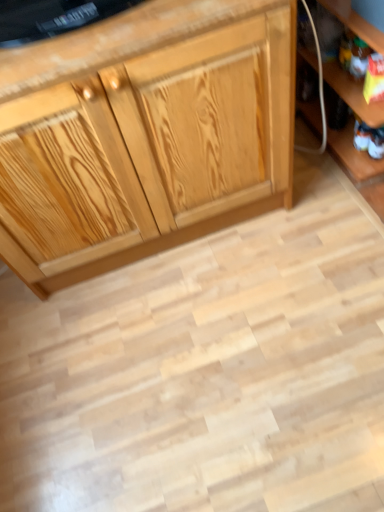
Question: Can we say wooden shelf at lower right lies outside white fabric toy at lower right?

Choices:
 (A) yes
 (B) no

Answer: (A)

Question: Is wooden shelf at lower right thinner than white fabric toy at lower right?

Choices:
 (A) yes
 (B) no

Answer: (B)

Question: Can you confirm if wooden shelf at lower right is shorter than white fabric toy at lower right?

Choices:
 (A) no
 (B) yes

Answer: (A)

Question: Considering the relative sizes of wooden shelf at lower right and white fabric toy at lower right in the image provided, is wooden shelf at lower right smaller than white fabric toy at lower right?

Choices:
 (A) yes
 (B) no

Answer: (B)

Question: Is white fabric toy at lower right surrounded by wooden shelf at lower right?

Choices:
 (A) no
 (B) yes

Answer: (B)

Question: From a real-world perspective, is white fabric toy at lower right positioned above or below natural wood cabinet at center?

Choices:
 (A) below
 (B) above

Answer: (A)

Question: In terms of height, does white fabric toy at lower right look taller or shorter compared to natural wood cabinet at center?

Choices:
 (A) tall
 (B) short

Answer: (B)

Question: Would you say white fabric toy at lower right is to the left or to the right of natural wood cabinet at center in the picture?

Choices:
 (A) right
 (B) left

Answer: (A)

Question: Considering their positions, is white fabric toy at lower right located in front of or behind natural wood cabinet at center?

Choices:
 (A) front
 (B) behind

Answer: (B)

Question: From the image's perspective, is natural wood cabinet at center positioned above or below white fabric toy at lower right?

Choices:
 (A) below
 (B) above

Answer: (B)

Question: Based on their positions, is natural wood cabinet at center located to the left or right of white fabric toy at lower right?

Choices:
 (A) right
 (B) left

Answer: (B)

Question: From a real-world perspective, relative to white fabric toy at lower right, is natural wood cabinet at center vertically above or below?

Choices:
 (A) below
 (B) above

Answer: (B)

Question: Considering the positions of natural wood cabinet at center and white fabric toy at lower right in the image, is natural wood cabinet at center wider or thinner than white fabric toy at lower right?

Choices:
 (A) thin
 (B) wide

Answer: (B)

Question: From the image's perspective, is natural wood cabinet at center located above or below wooden shelf at lower right?

Choices:
 (A) below
 (B) above

Answer: (A)

Question: Based on their sizes in the image, would you say natural wood cabinet at center is bigger or smaller than wooden shelf at lower right?

Choices:
 (A) big
 (B) small

Answer: (A)